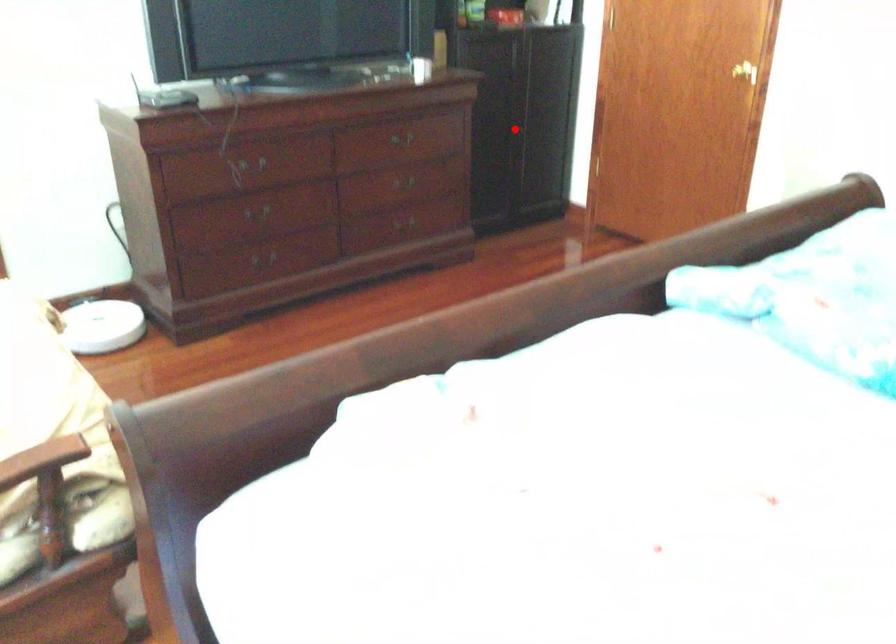
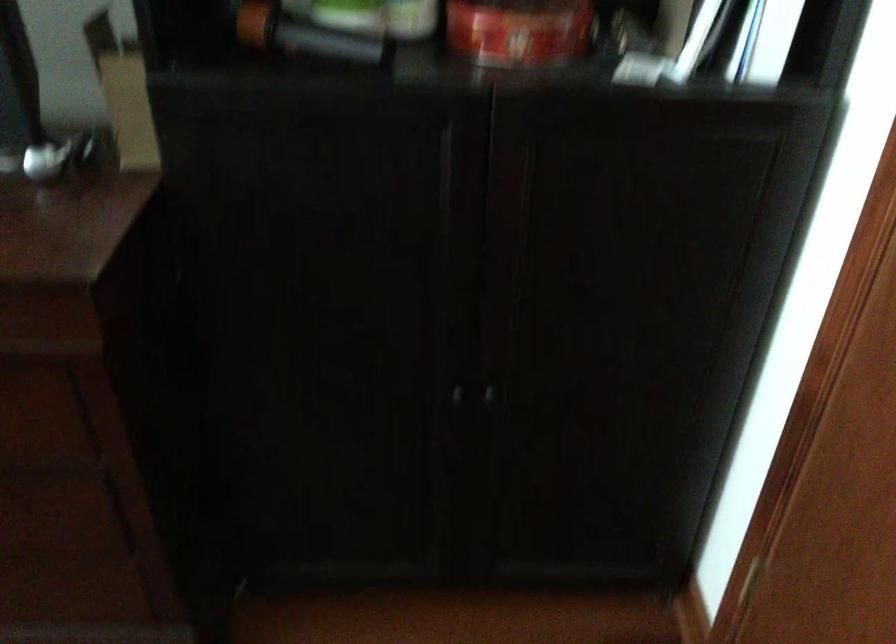
Locate, in the second image, the point that corresponds to the highlighted location in the first image.

(457, 395)